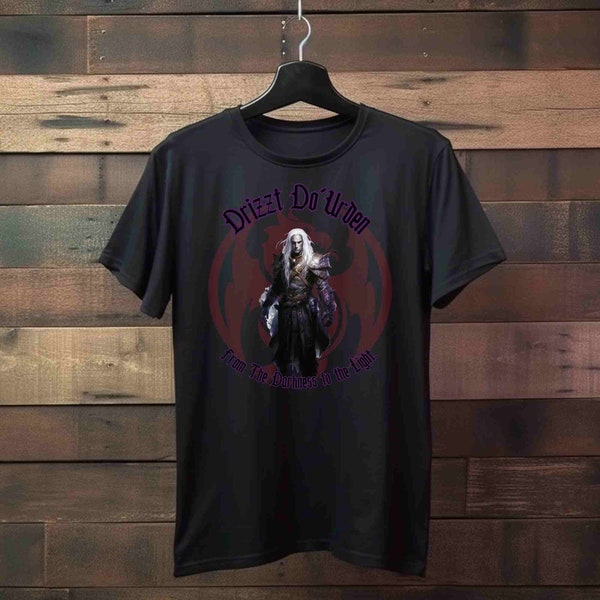
Identify the location of metal hook. Image resolution: width=600 pixels, height=600 pixels. (300, 54).